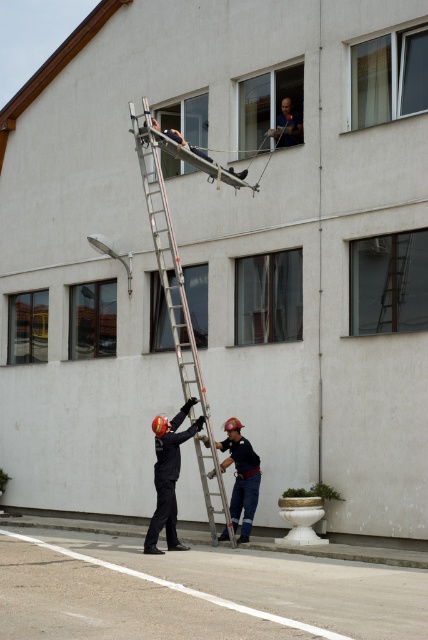
Between silver metallic ladder at center and clear glass window at upper center, which one has less height?

With less height is clear glass window at upper center.

Find the location of a particular element. silver metallic ladder at center is located at coordinates (177, 298).

Where is `silver metallic ladder at center`? silver metallic ladder at center is located at coordinates (177, 298).

The width and height of the screenshot is (428, 640). Identify the location of clear glass window at center. (269, 298).

At what (x,y) coordinates should I click in order to perform the action: click on clear glass window at center. Please return your answer as a coordinate pair (x, y). The image size is (428, 640). Looking at the image, I should click on (269, 298).

Does dark blue uniform at lower center appear on the right side of clear glass window at lower left?

Yes, dark blue uniform at lower center is to the right of clear glass window at lower left.

What do you see at coordinates (240, 476) in the screenshot?
I see `dark blue uniform at lower center` at bounding box center [240, 476].

Find the location of a particular element. This screenshot has width=428, height=640. dark blue uniform at lower center is located at coordinates (240, 476).

At what (x,y) coordinates should I click in order to perform the action: click on dark blue uniform at lower center. Please return your answer as a coordinate pair (x, y). Looking at the image, I should click on (240, 476).